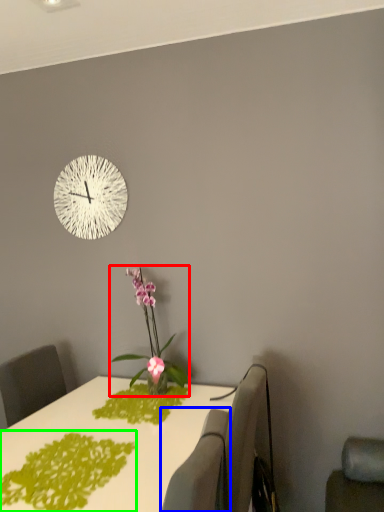
Question: Which object is the closest to the houseplant (highlighted by a red box)? Choose among these: swivel chair (highlighted by a blue box) or design (highlighted by a green box).

Choices:
 (A) swivel chair
 (B) design

Answer: (B)